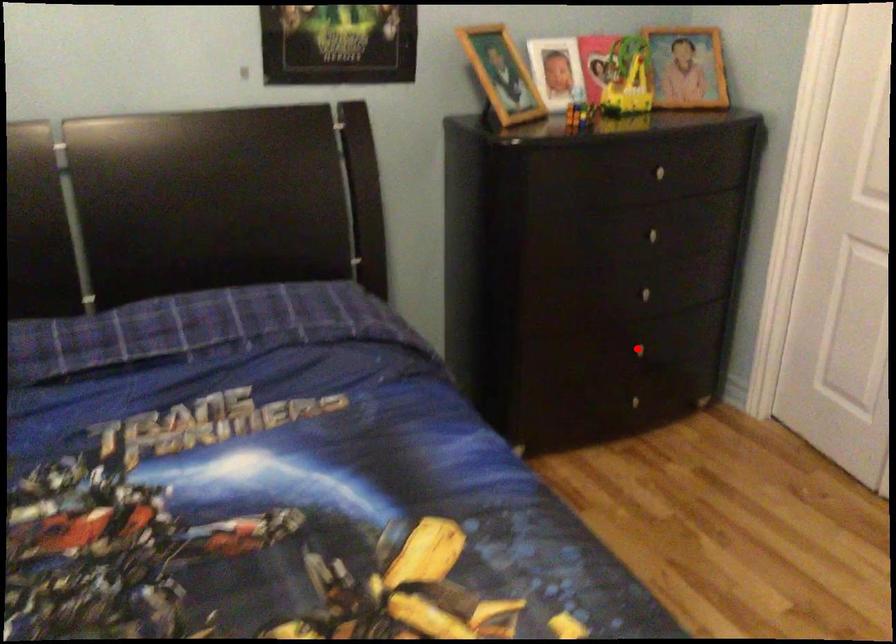
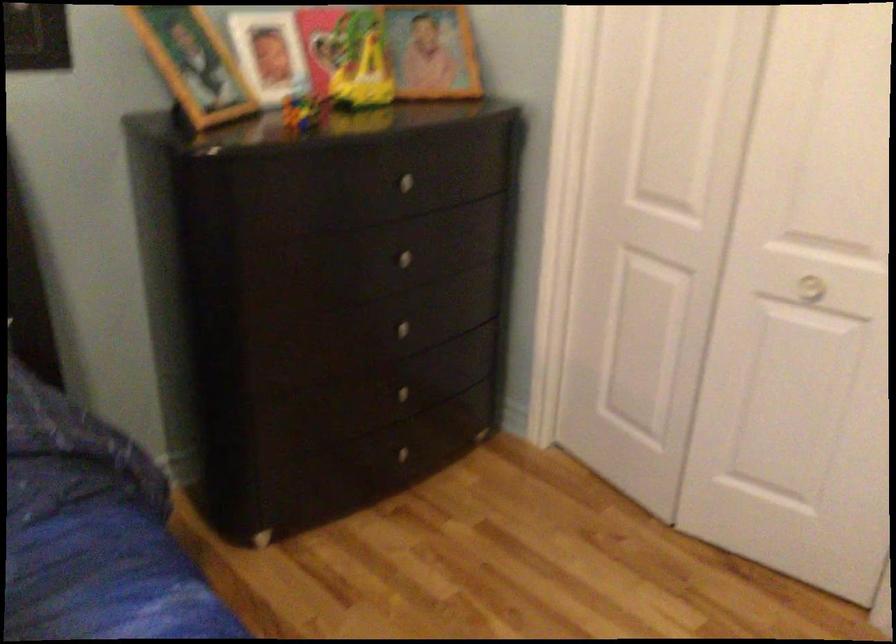
Locate, in the second image, the point that corresponds to the highlighted location in the first image.

(400, 393)